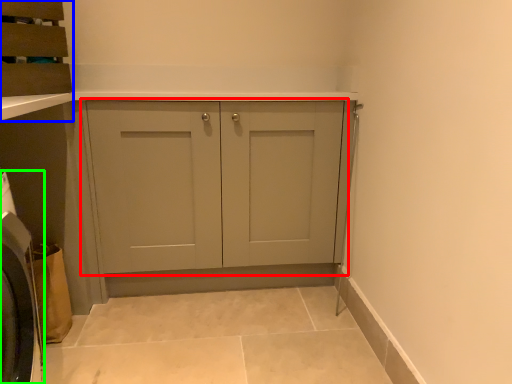
Question: Which is nearer to the cupboard (highlighted by a red box)? cabinetry (highlighted by a blue box) or washing machine (highlighted by a green box).

Choices:
 (A) cabinetry
 (B) washing machine

Answer: (A)